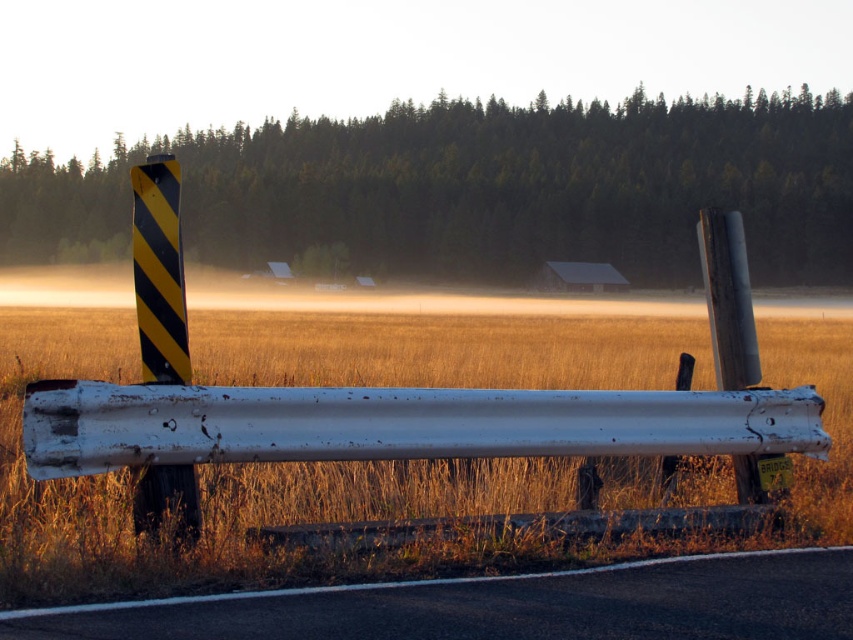
Question: Is foggy mist at upper center to the right of white metal guardrail at center from the viewer's perspective?

Choices:
 (A) no
 (B) yes

Answer: (A)

Question: Which object is closer to the camera taking this photo?

Choices:
 (A) dry grass at center
 (B) white metal guardrail at center
 (C) yellow-black striped pole at left

Answer: (A)

Question: Which point appears closest to the camera in this image?

Choices:
 (A) (258, 451)
 (B) (670, 346)
 (C) (21, 196)
 (D) (154, 173)

Answer: (A)

Question: Does dry grass at center have a larger size compared to yellow-black striped pole at left?

Choices:
 (A) yes
 (B) no

Answer: (A)

Question: Which object is closer to the camera taking this photo?

Choices:
 (A) white metal guardrail at center
 (B) yellow-black striped pole at left
 (C) foggy mist at upper center

Answer: (A)

Question: Can you confirm if white metal guardrail at center is positioned to the right of yellow-black striped pole at left?

Choices:
 (A) no
 (B) yes

Answer: (B)